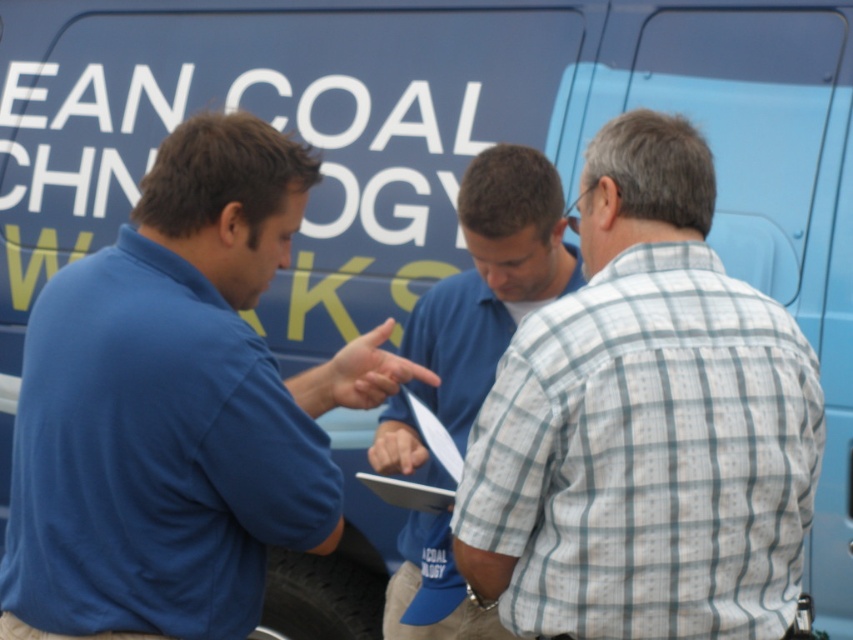
Which of these two, blue cotton shirt at left or white paper clipboard at center, stands shorter?

white paper clipboard at center is shorter.

Can you confirm if blue cotton shirt at left is thinner than white paper clipboard at center?

No.

Between point (257, 449) and point (369, 476), which one is positioned behind?

The point (369, 476) is behind.

Identify the location of blue cotton shirt at left. The image size is (853, 640). (177, 406).

Between point (223, 120) and point (486, 228), which one is positioned behind?

The point (486, 228) is more distant.

Between blue cotton shirt at left and blue shirt at center, which one is positioned higher?

blue cotton shirt at left

The width and height of the screenshot is (853, 640). I want to click on blue cotton shirt at left, so click(177, 406).

Which of these two, blue shirt at center or white paper clipboard at center, stands shorter?

With less height is white paper clipboard at center.

I want to click on blue shirt at center, so click(490, 280).